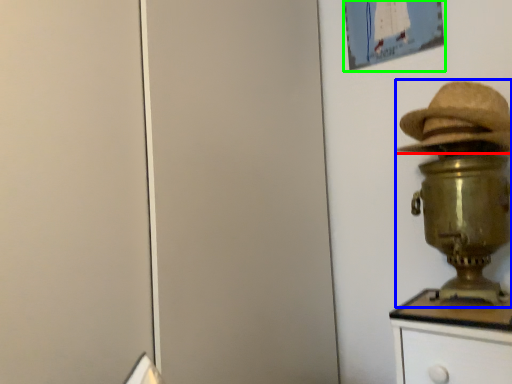
Question: Based on their relative distances, which object is farther from hat (highlighted by a red box)? Choose from table lamp (highlighted by a blue box) and picture frame (highlighted by a green box).

Choices:
 (A) table lamp
 (B) picture frame

Answer: (B)